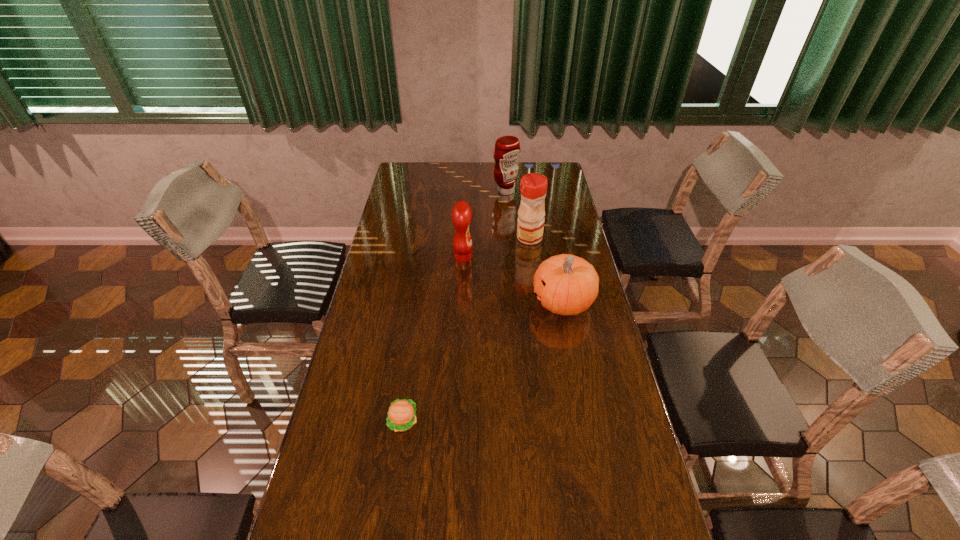
Identify the location of the second farthest condiment. Image resolution: width=960 pixels, height=540 pixels. (533, 187).

Find the location of a particular element. This screenshot has height=540, width=960. the farthest object is located at coordinates (507, 148).

The height and width of the screenshot is (540, 960). I want to click on the third farthest object, so click(x=461, y=214).

You are a GUI agent. You are given a task and a screenshot of the screen. Output one action in this format:
    pyautogui.click(x=<x>, y=<y>)
    Task: Click on the fourth object from right to left
    Image resolution: width=960 pixels, height=540 pixels.
    Given the screenshot: What is the action you would take?
    point(461,214)

I want to click on pumpkin, so click(x=565, y=284).

The image size is (960, 540). I want to click on the nearest object, so click(401, 416).

Find the location of `the shortest object`. the shortest object is located at coordinates [401, 416].

The height and width of the screenshot is (540, 960). What are the coordinates of `free region located 0.210m on the front of the fourth nearest object` in the screenshot? It's located at (x=536, y=281).

At what (x,y) coordinates should I click in order to perform the action: click on vacant space located on the left of the farthest object. Please return your answer as a coordinate pair (x, y). Image resolution: width=960 pixels, height=540 pixels. Looking at the image, I should click on (431, 191).

Where is `blank space located on the label side of the third farthest object`? The height and width of the screenshot is (540, 960). blank space located on the label side of the third farthest object is located at coordinates (577, 258).